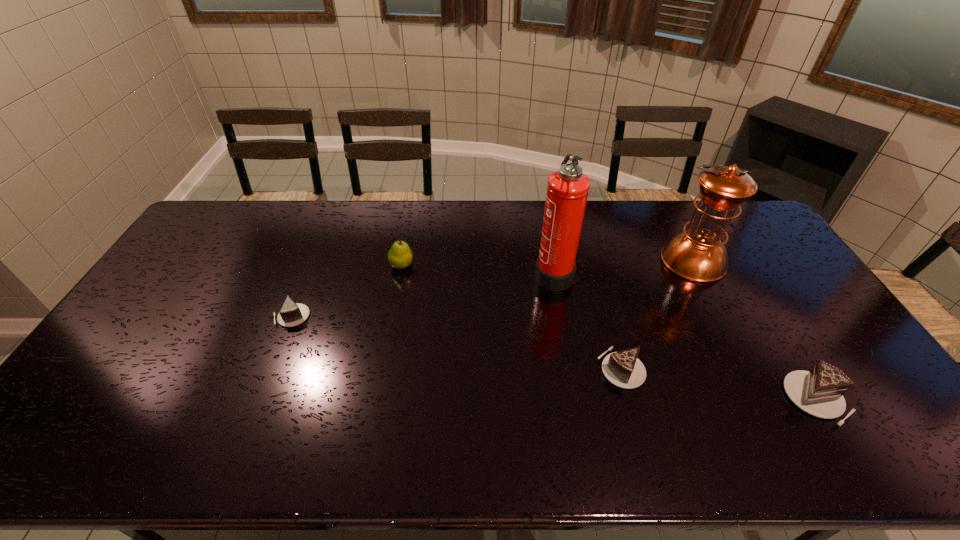
You are a GUI agent. You are given a task and a screenshot of the screen. Output one action in this format:
    pyautogui.click(x=<x>, y=<y>)
    Task: Click on the farthest chocolate cake
    
    Given the screenshot: What is the action you would take?
    pyautogui.click(x=291, y=314)

This screenshot has height=540, width=960. Find the location of `the leftmost chocolate cake`. the leftmost chocolate cake is located at coordinates (291, 314).

Where is `the second tallest chocolate cake`? The height and width of the screenshot is (540, 960). the second tallest chocolate cake is located at coordinates (623, 369).

The height and width of the screenshot is (540, 960). What are the coordinates of `the second chocolate cake from left to right` in the screenshot? It's located at (623, 369).

Identify the location of the fourth tallest object. (819, 392).

You are a GUI agent. You are given a task and a screenshot of the screen. Output one action in this format:
    pyautogui.click(x=<x>, y=<y>)
    Task: Click on the tallest chocolate cake
    This screenshot has width=960, height=540.
    Given the screenshot: What is the action you would take?
    pyautogui.click(x=819, y=392)

Identify the location of the fifth shortest object. This screenshot has width=960, height=540. (698, 254).

This screenshot has width=960, height=540. I want to click on the fourth shortest object, so click(x=400, y=256).

Where is `the second object from left to right`? The width and height of the screenshot is (960, 540). the second object from left to right is located at coordinates (400, 256).

Find the location of `fire extinguisher`. fire extinguisher is located at coordinates (567, 190).